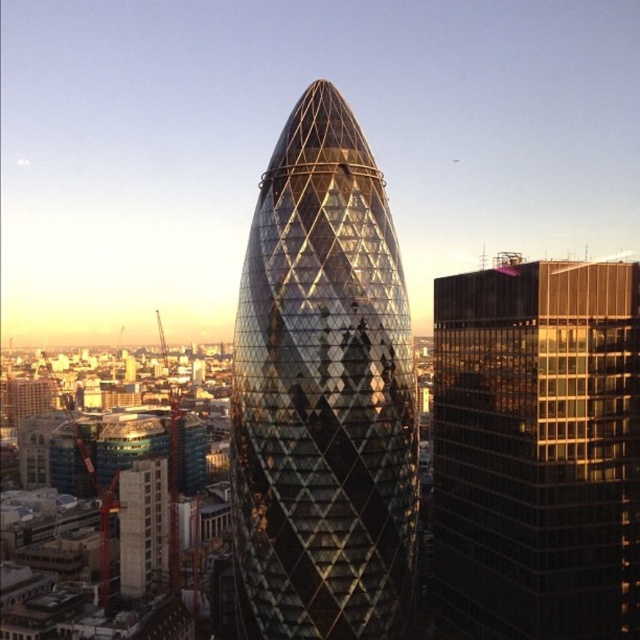
You are a tourist standing in front of the Gherkin. You notice the shiny glass tower at center and the black glass building at right. Which building is nearer to you?

The shiny glass tower at center is closer to the viewer than the black glass building at right.

You are standing in front of the Gherkin building and notice two points marked in the scene. The first point is at coordinates point (362, 192) and the second is at point (541, 452). Which of these points is nearer to you?

Point (362, 192) is closer to the viewer than point (541, 452).